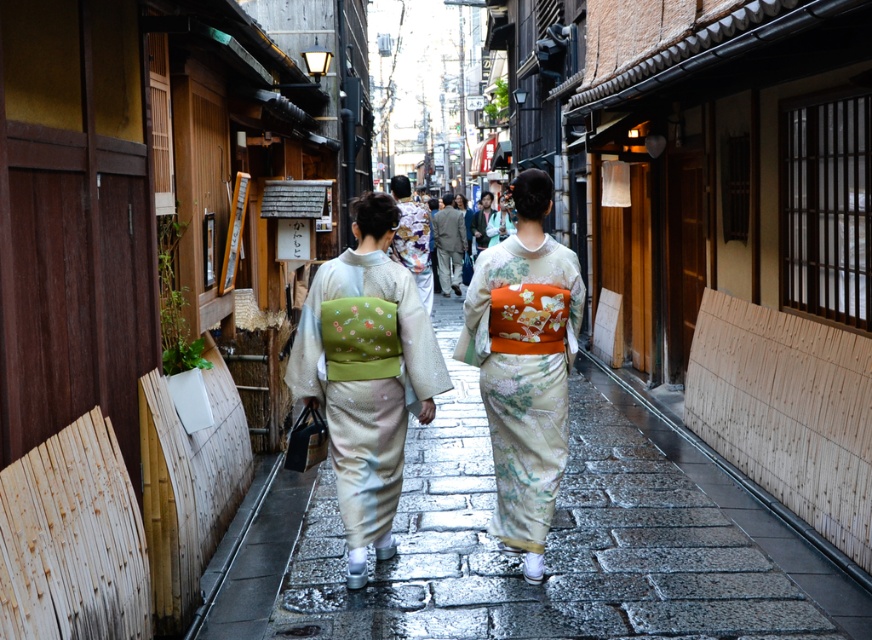
You are a photographer trying to capture the two individuals in the scene. Since the smooth stone pavement at center and the matte green kimono at center are both at the center, which one should you focus on to ensure the other is in the background?

The smooth stone pavement at center is smaller than the matte green kimono at center, so focusing on the matte green kimono at center will place the smaller smooth stone pavement at center in the background.

You are a photographer planning to capture a photo of the silky white kimono at center and the smooth stone pavement at center. Based on their sizes, which object should you focus on first to ensure it fits entirely within the frame?

The silky white kimono at center is wider than the smooth stone pavement at center, so you should focus on capturing the silky white kimono at center first to ensure it fits entirely within the frame.